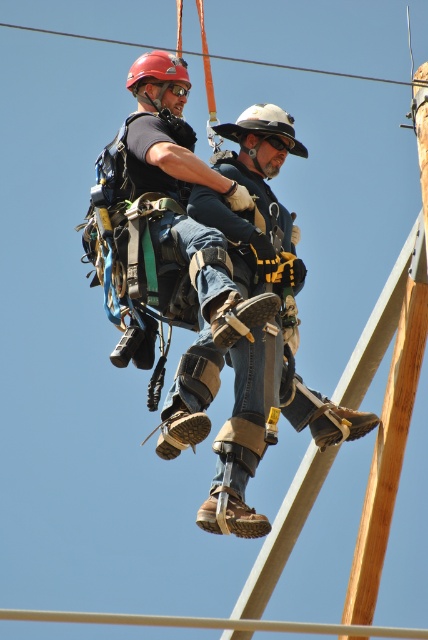
Question: Can you confirm if orange rope at upper center is bigger than matte red helmet at upper left?

Choices:
 (A) yes
 (B) no

Answer: (A)

Question: Is white matte helmet at center to the right of orange rope at upper center from the viewer's perspective?

Choices:
 (A) no
 (B) yes

Answer: (A)

Question: Estimate the real-world distances between objects in this image. Which object is closer to the matte black prosthetic leg at center?

Choices:
 (A) matte red helmet at upper left
 (B) white matte helmet at center

Answer: (B)

Question: Which point is closer to the camera?

Choices:
 (A) (163, 74)
 (B) (386, 83)
 (C) (252, 120)

Answer: (C)

Question: Which of the following is the farthest from the observer?

Choices:
 (A) (134, 72)
 (B) (305, 67)

Answer: (B)

Question: Is white matte helmet at center wider than orange rope at upper center?

Choices:
 (A) no
 (B) yes

Answer: (A)